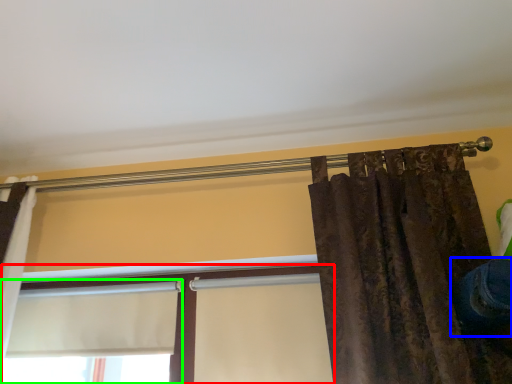
Question: Considering the real-world distances, which object is closest to window (highlighted by a red box)? jeans (highlighted by a blue box) or window (highlighted by a green box).

Choices:
 (A) jeans
 (B) window

Answer: (B)